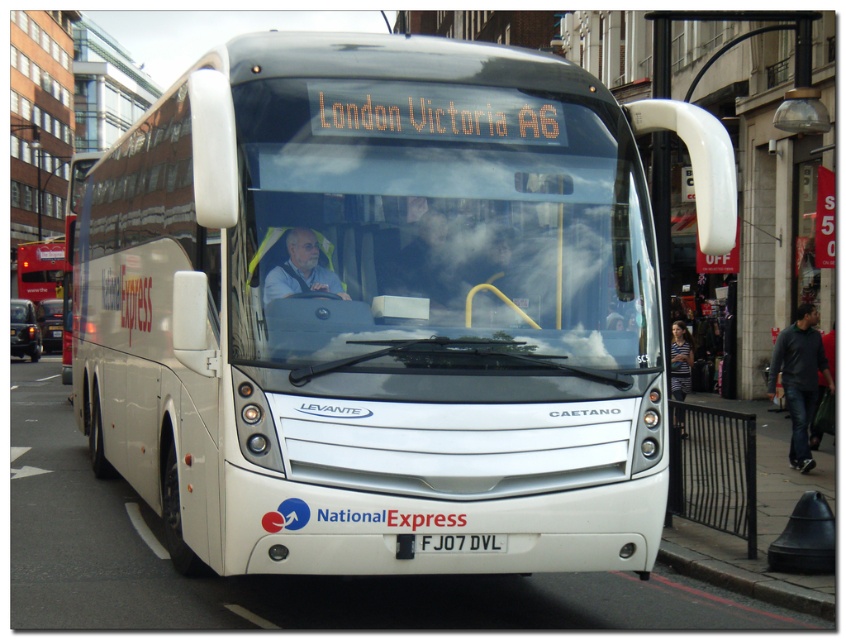
Is dark gray jeans at lower right in front of white plastic license plate at center?

No, it is behind white plastic license plate at center.

Is point (795, 353) farther from camera compared to point (465, 538)?

Yes, point (795, 353) is farther from viewer.

At what (x,y) coordinates should I click in order to perform the action: click on dark gray jeans at lower right. Please return your answer as a coordinate pair (x, y). Looking at the image, I should click on (799, 378).

Is white matte bus at center to the left of matte white bus at left from the viewer's perspective?

In fact, white matte bus at center is to the right of matte white bus at left.

Is white matte bus at center shorter than matte white bus at left?

Yes, white matte bus at center is shorter than matte white bus at left.

This screenshot has width=846, height=640. I want to click on white matte bus at center, so click(386, 307).

Looking at this image, does dark gray jeans at lower right appear on the left side of striped fabric shirt at right?

No, dark gray jeans at lower right is not to the left of striped fabric shirt at right.

Can you confirm if dark gray jeans at lower right is bigger than striped fabric shirt at right?

Actually, dark gray jeans at lower right might be smaller than striped fabric shirt at right.

Locate an element on the screen. The width and height of the screenshot is (846, 640). dark gray jeans at lower right is located at coordinates (799, 378).